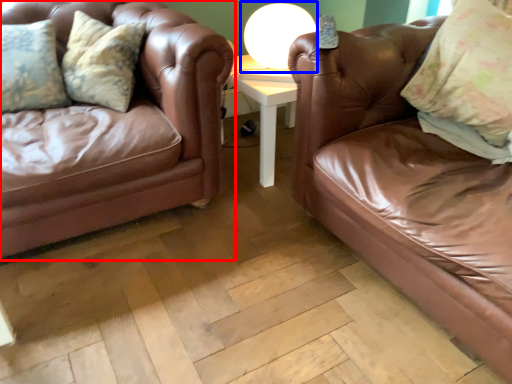
Question: Which object is closer to the camera taking this photo, studio couch (highlighted by a red box) or table lamp (highlighted by a blue box)?

Choices:
 (A) studio couch
 (B) table lamp

Answer: (A)